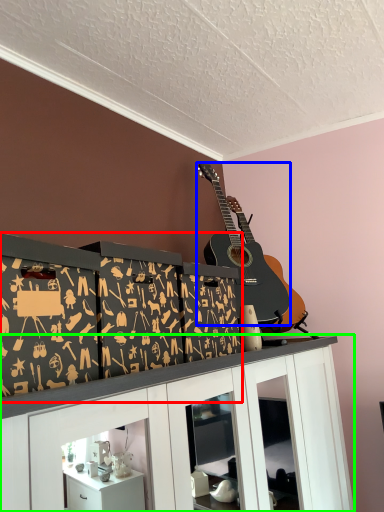
Question: Which object is the farthest from shelf (highlighted by a red box)? Choose among these: guitar (highlighted by a blue box) or cabinetry (highlighted by a green box).

Choices:
 (A) guitar
 (B) cabinetry

Answer: (A)